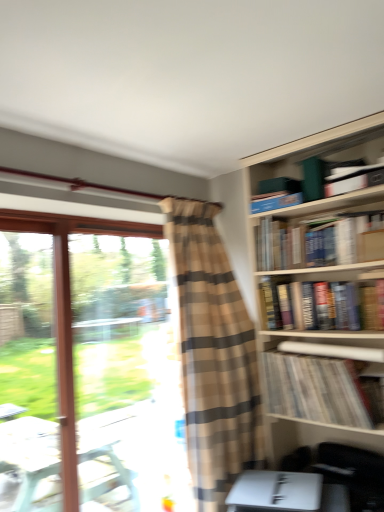
Question: From the image's perspective, is hardcover books at upper right, marked as the 4th book in a top-to-bottom arrangement, above or below brown plaid curtain at center?

Choices:
 (A) below
 (B) above

Answer: (B)

Question: Considering the positions of point (357, 301) and point (198, 418), is point (357, 301) closer or farther from the camera than point (198, 418)?

Choices:
 (A) farther
 (B) closer

Answer: (A)

Question: Which of these objects is positioned farthest from the blue hardcover book at upper right, which is the second book in top-to-bottom order?

Choices:
 (A) white matte paperback book at lower right
 (B) striped paper at upper right, the 1th book in the bottom-to-top sequence
 (C) brown plaid curtain at center
 (D) hardcover book at upper right, which is the 3th book from top to bottom
 (E) white paper at center-right, placed as the 2th book when sorted from bottom to top

Answer: (A)

Question: Estimate the real-world distances between objects in this image. Which object is farther from the brown plaid curtain at center?

Choices:
 (A) striped paper at upper right, which ranks as the 6th book in top-to-bottom order
 (B) white paper at center-right, acting as the fifth book starting from the top
 (C) white matte paperback book at lower right
 (D) blue hardcover book at upper right, which is counted as the fifth book, starting from the bottom
 (E) white cardboard box at upper right, the sixth book when ordered from bottom to top

Answer: (E)